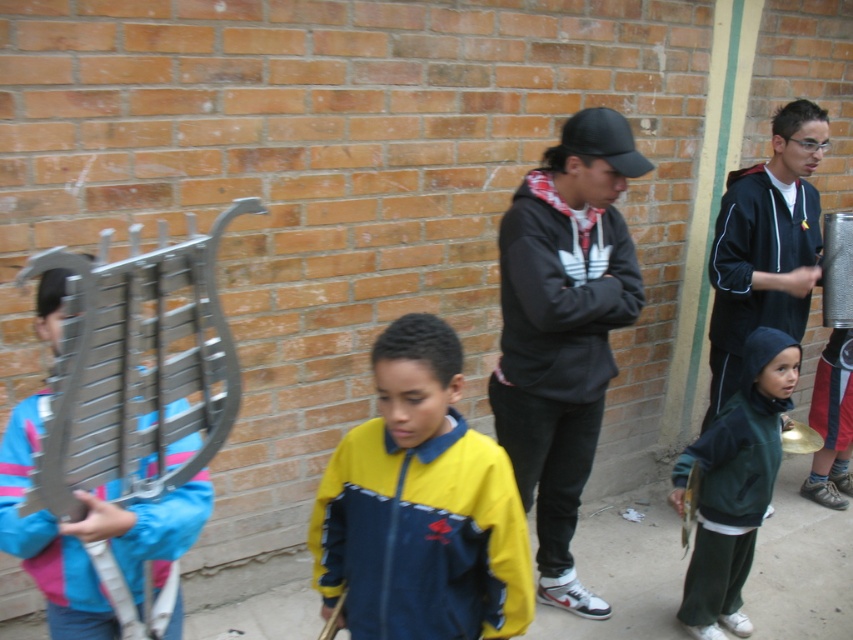
Based on the photo, you are a photographer trying to capture both the metallic silver lyre at left and the gold metallic bell at lower right in the same frame. Based on their positions, which one should you adjust your camera angle to focus on first to ensure both are in the frame?

The metallic silver lyre at left is above the gold metallic bell at lower right, so you should focus on the metallic silver lyre at left first to ensure both are in the frame.

You are a fashion designer observing the jackets in the scene. Which jacket, the black matte jacket at center or the dark green fleece jacket at lower right, has a greater width?

The black matte jacket at center has a greater width than the dark green fleece jacket at lower right according to the description.